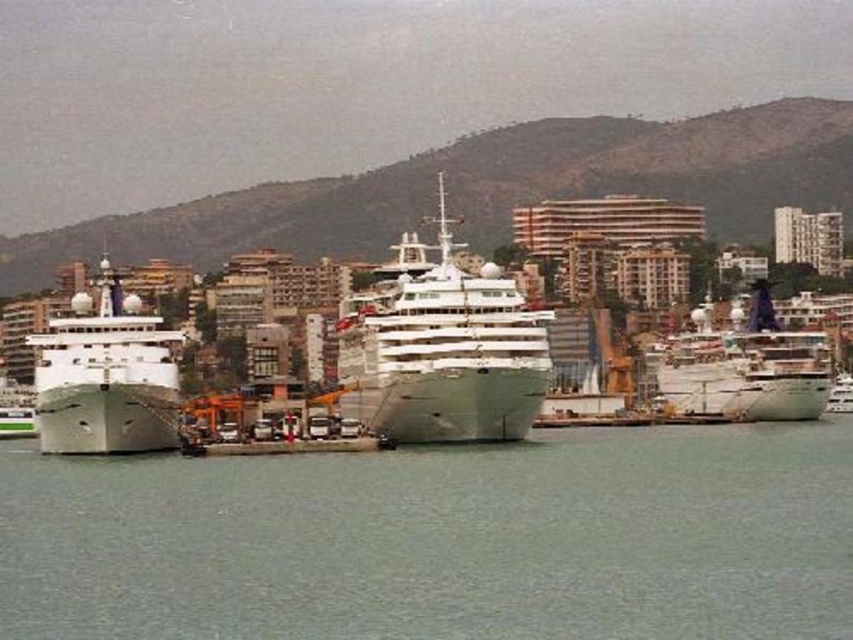
You are standing at the edge of the pier looking out at the harbor. There are two points marked in the scene. Which point, point (460, 483) or point (120, 310), is closer to you?

Point (460, 483) is closer to you than point (120, 310).

You are an observer standing on the pier. You see the white glossy cruise ship at center and the white glossy ship at right. Which ship appears nearer to you?

The white glossy cruise ship at center is closer to the viewer than the white glossy ship at right, so it appears nearer.

You are a harbor pilot guiding ships into the dock. You need to position the white glossy cruise ship at center and the green matte ship at left so that they are aligned with the harbor entrance. Which ship should you move to the left to achieve proper alignment?

The green matte ship at left is already positioned to the left of the white glossy cruise ship at center. To align them with the harbor entrance, you should move the green matte ship at left further to the left so that both ships are properly aligned with the entrance.